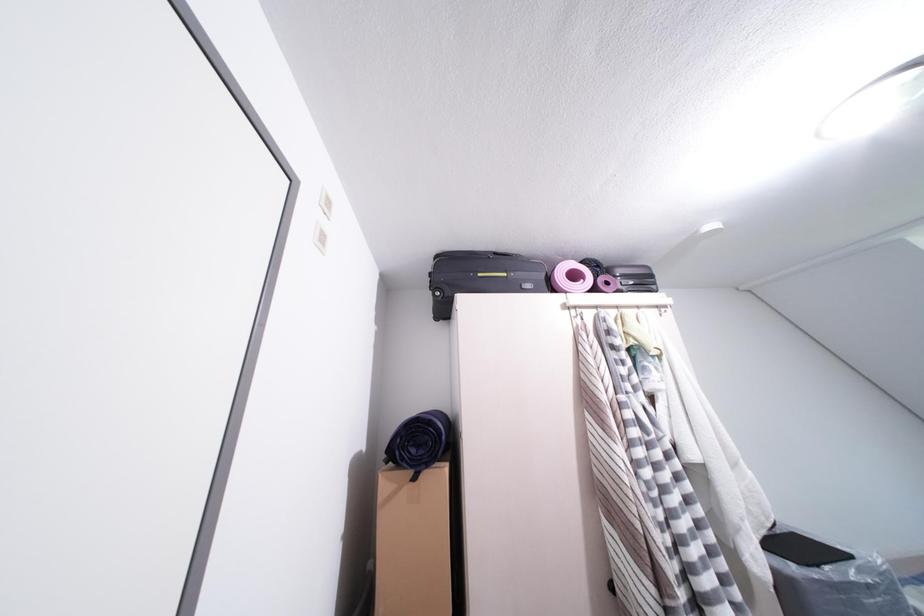
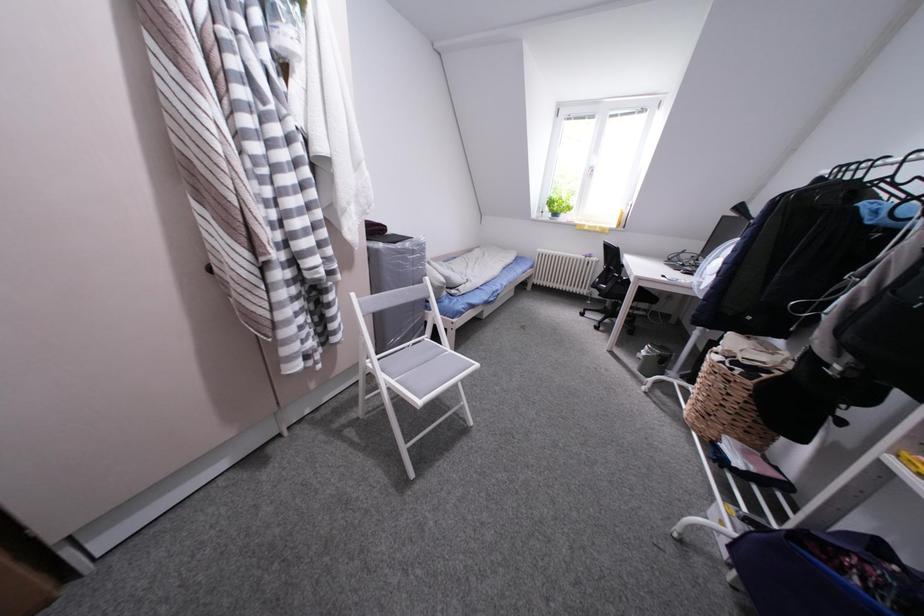
The first image is from the beginning of the video and the second image is from the end. How did the camera likely rotate when shooting the video?

The camera's rotation is toward right-down.